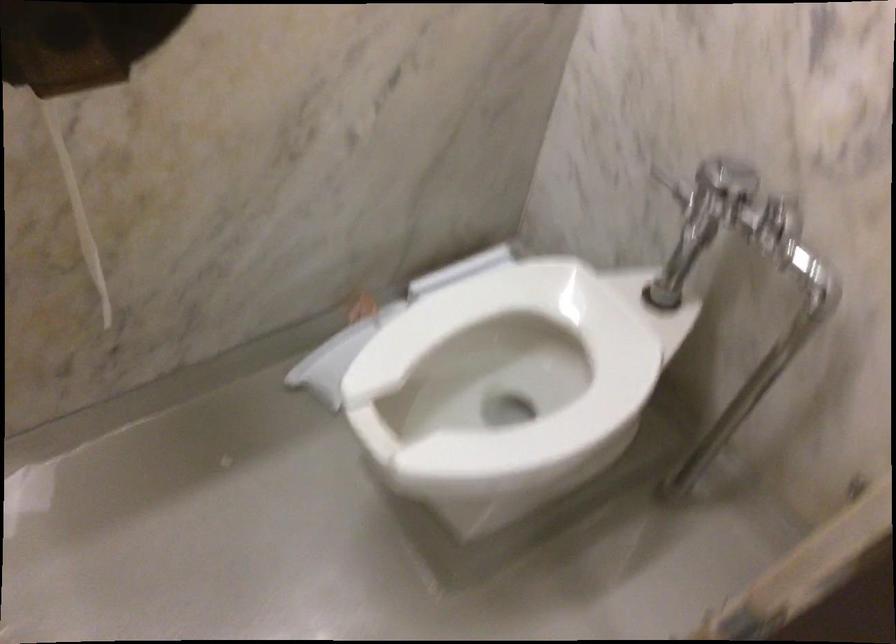
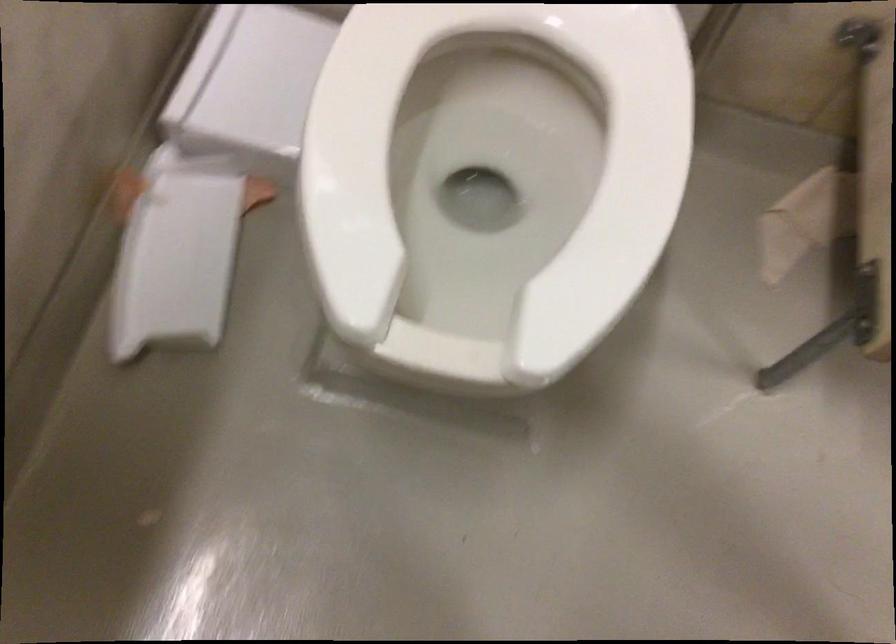
The images are taken continuously from a first-person perspective. In which direction is your viewpoint rotating?

The camera rotated toward right-down.